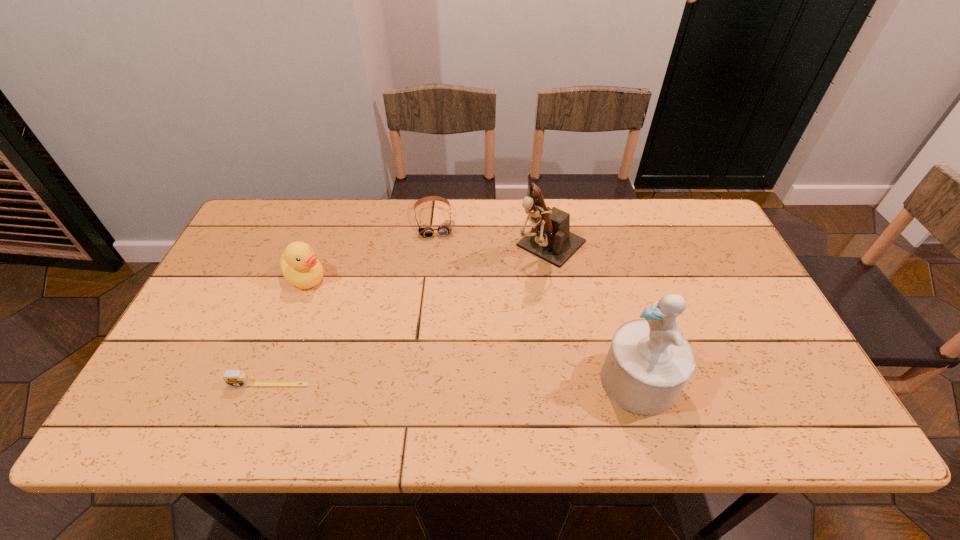
Where is `tape measure`? tape measure is located at coordinates (233, 378).

The image size is (960, 540). Find the location of `the nearer figurine`. the nearer figurine is located at coordinates (648, 363).

Where is `the third shortest object`? Image resolution: width=960 pixels, height=540 pixels. the third shortest object is located at coordinates (299, 265).

Image resolution: width=960 pixels, height=540 pixels. What are the coordinates of `the farther figurine` in the screenshot? It's located at (550, 238).

Find the location of a particular element. the third object from left to right is located at coordinates (x=446, y=227).

Find the location of a particular element. This screenshot has height=540, width=960. vacant area situated at the beak of the nearer figurine is located at coordinates (438, 381).

Image resolution: width=960 pixels, height=540 pixels. Identify the location of free space located at the beak of the nearer figurine. tap(490, 381).

At what (x,y) coordinates should I click in order to perform the action: click on vacant space located 0.090m at the beak of the nearer figurine. Please return your answer as a coordinate pair (x, y). This screenshot has height=540, width=960. Looking at the image, I should click on (563, 381).

Where is `vacant area situated at the beak of the duck`? The width and height of the screenshot is (960, 540). vacant area situated at the beak of the duck is located at coordinates [358, 326].

Identify the location of free space located at the beak of the duck. (399, 366).